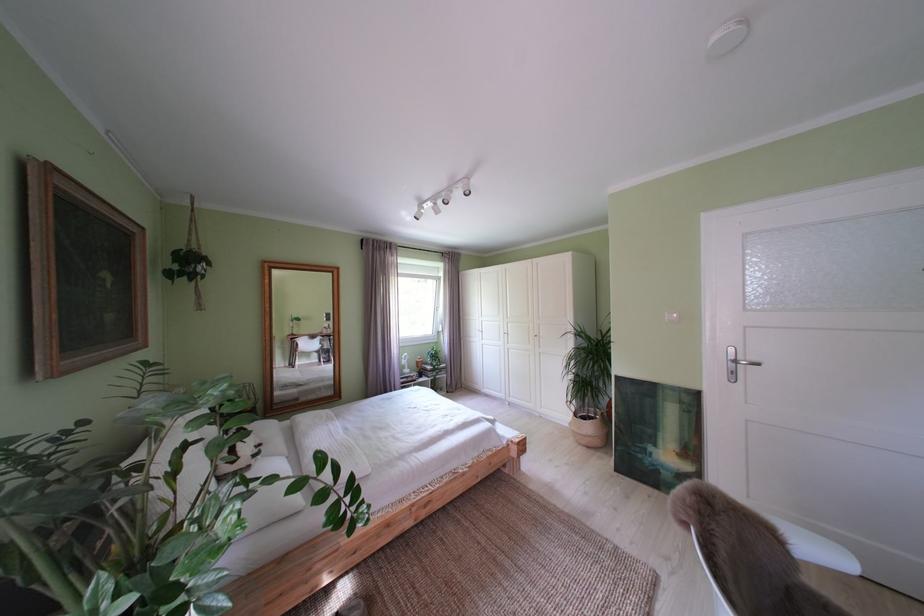
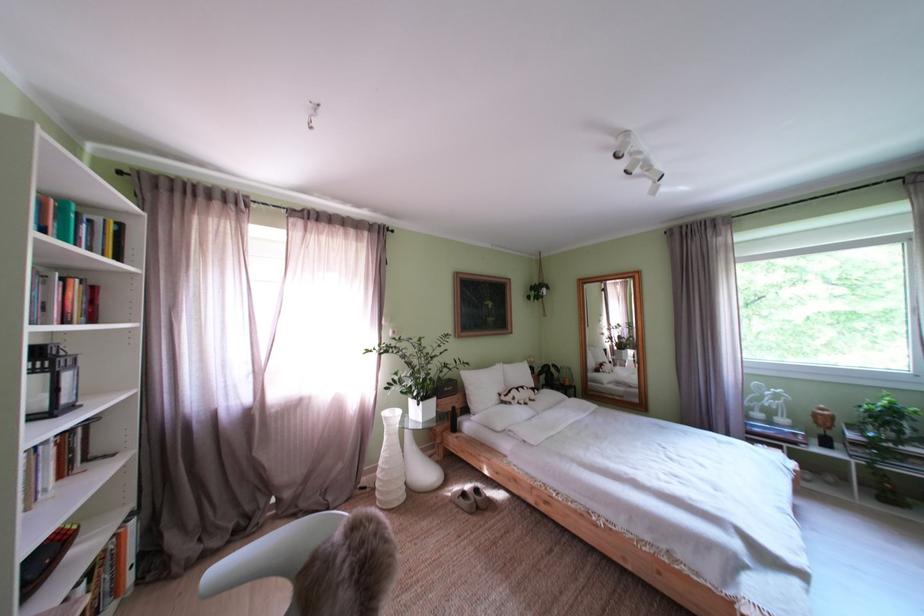
In the second image, find the point that corresponds to pixel 429 368 in the first image.

(825, 419)